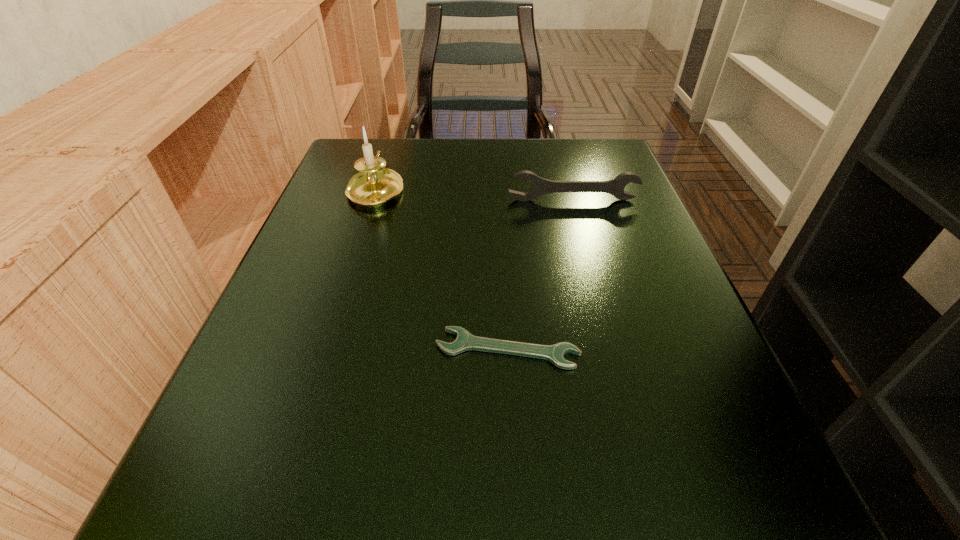
You are a GUI agent. You are given a task and a screenshot of the screen. Output one action in this format:
    pyautogui.click(x=<x>, y=<y>)
    Task: Click on the leftmost object
    The height and width of the screenshot is (540, 960).
    Given the screenshot: What is the action you would take?
    pyautogui.click(x=374, y=185)

Where is `the tallest object`? The height and width of the screenshot is (540, 960). the tallest object is located at coordinates (374, 185).

You are a GUI agent. You are given a task and a screenshot of the screen. Output one action in this format:
    pyautogui.click(x=<x>, y=<y>)
    Task: Click on the farther wrench
    Image resolution: width=960 pixels, height=540 pixels.
    Given the screenshot: What is the action you would take?
    pyautogui.click(x=539, y=186)

What are the coordinates of `the taller wrench` in the screenshot? It's located at (539, 186).

Identify the location of the shortest object. (465, 341).

This screenshot has width=960, height=540. What are the coordinates of `the nearest object` in the screenshot? It's located at (465, 341).

The height and width of the screenshot is (540, 960). I want to click on vacant space located on the handle side of the leftmost object, so click(x=393, y=137).

Identify the location of vacant space situated 0.150m on the handle side of the leftmost object. Image resolution: width=960 pixels, height=540 pixels. (393, 137).

Locate an element on the screen. vacant space situated on the handle side of the leftmost object is located at coordinates (393, 137).

The height and width of the screenshot is (540, 960). Identify the location of vacant area situated 0.140m on the open ends of the second shortest object. (586, 248).